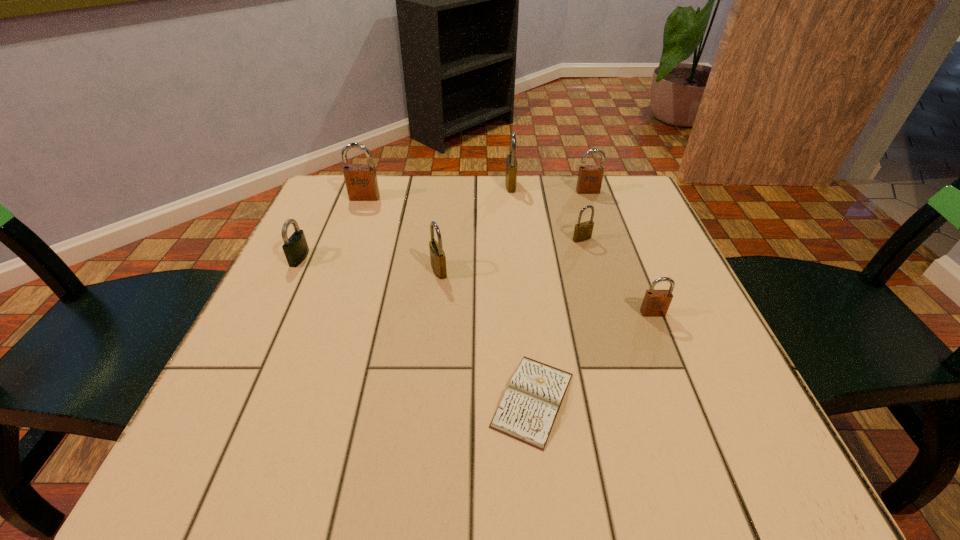
This screenshot has height=540, width=960. Identify the location of free space at the far left corner of the desktop. (336, 194).

Find the location of a particular element. free location at the near right corner is located at coordinates (671, 474).

In order to click on vacant space that's between the farthest brown padlock and the shortest object in this screenshot , I will do `click(561, 296)`.

The image size is (960, 540). In order to click on vacant area that lies between the second smallest brown padlock and the diary in this screenshot , I will do `click(561, 296)`.

At what (x,y) coordinates should I click in order to perform the action: click on vacant area that lies between the black padlock and the smallest brown padlock. Please return your answer as a coordinate pair (x, y). This screenshot has width=960, height=540. Looking at the image, I should click on (476, 286).

In order to click on vacant area that lies between the third farthest padlock and the third object from left to right in this screenshot , I will do `click(401, 234)`.

This screenshot has width=960, height=540. What are the coordinates of `blank region between the fourth farthest object and the biggest brass padlock` in the screenshot? It's located at (546, 212).

At what (x,y) coordinates should I click in order to perform the action: click on vacant space that is in between the biggest brass padlock and the nearest object. Please return your answer as a coordinate pair (x, y). Looking at the image, I should click on (522, 293).

Locate an element on the screen. The image size is (960, 540). vacant region between the shortest object and the fifth nearest padlock is located at coordinates [448, 299].

Locate an element on the screen. empty space between the biggest brass padlock and the second smallest brown padlock is located at coordinates (549, 188).